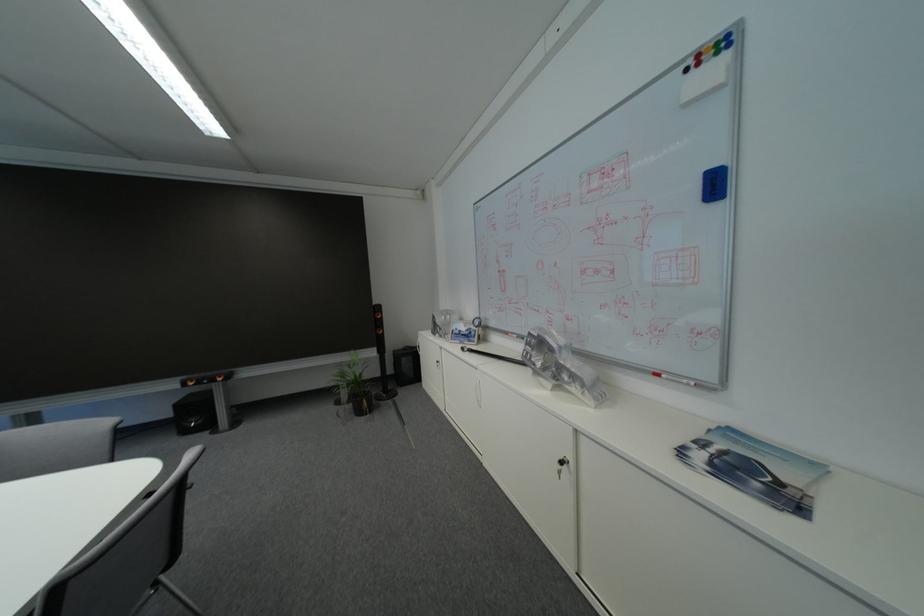
Where is `cabinet door lock`? cabinet door lock is located at coordinates (565, 474).